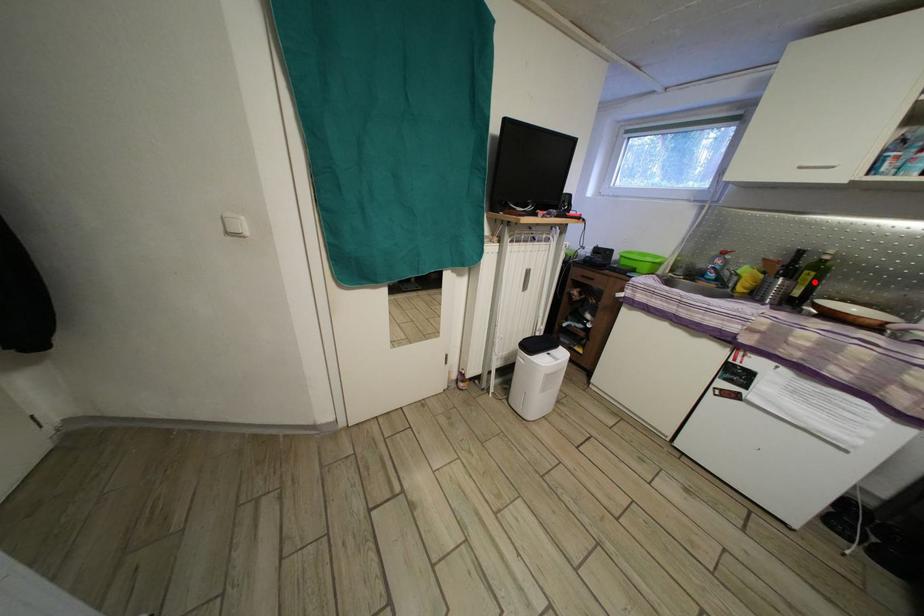
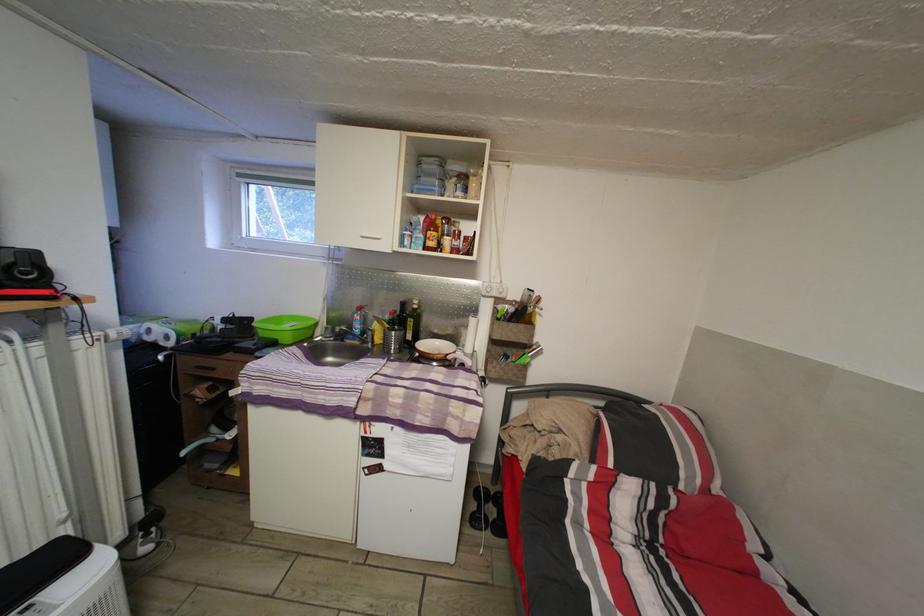
Question: I am providing you with two images of the same scene from different viewpoints. A red point is marked on the first image. At the location where the point appears in image 1, is it still visible in image 2?

Choices:
 (A) Yes
 (B) No

Answer: (A)